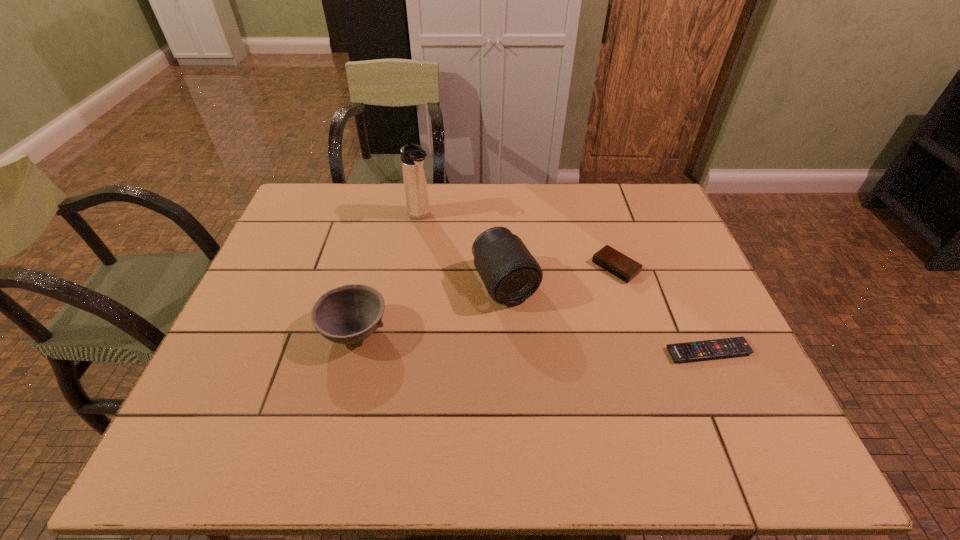
Find the location of `vacant space on the desktop that is between the bowl and the remote control and is positioned on the front face of the second shortest object`. vacant space on the desktop that is between the bowl and the remote control and is positioned on the front face of the second shortest object is located at coordinates (525, 341).

What are the coordinates of `free space on the desktop that is between the third shortest object and the remote control and is positioned on the handle side of the tallest object` in the screenshot? It's located at (526, 341).

The image size is (960, 540). Identify the location of vacant space on the desktop that is between the bowl and the shortest object and is positioned on the surface of the second tallest object. (539, 341).